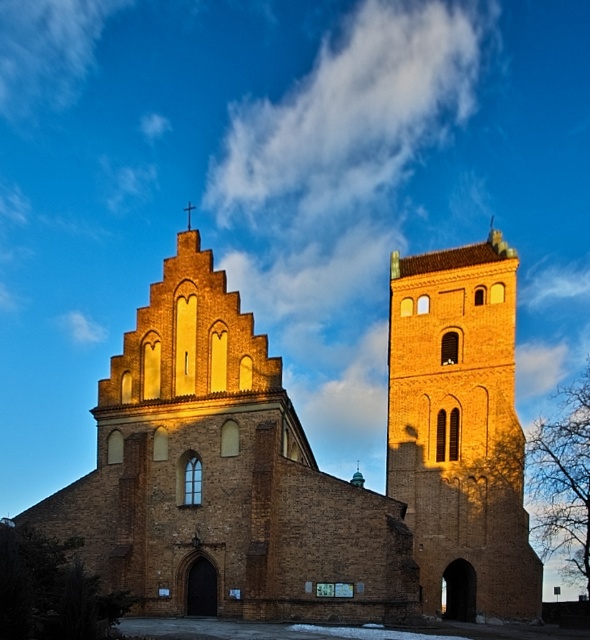
You are a tourist visiting the historic site and want to take a photo that includes both the brown brick church at center and the brown brick tower at center. Given their sizes, which one should you position closer to the camera to ensure both are fully visible in the frame?

The brown brick church at center is larger than the brown brick tower at center. To ensure both are fully visible, position the brown brick tower at center closer to the camera since it is smaller, allowing the larger church to fit in the background.

You are standing in front of the historic brick church and want to take a photo that includes both the brown brick church at center and the brown brick tower at center. Based on their positions, which one should you position to the right side of your camera frame to include both in the shot?

You should position the brown brick tower at center to the right side of your camera frame because the brown brick church at center is to the left of the brown brick tower at center, meaning the tower is on the right side relative to the church.

You are standing at the point marked by coordinates point (309, 460). Based on the scene description, what object is located exactly at this coordinate?

The point (309, 460) marks the brown brick church at center.